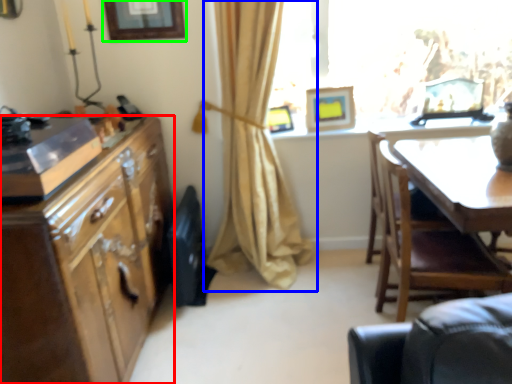
Question: Which object is the farthest from cabinetry (highlighted by a red box)? Choose among these: curtain (highlighted by a blue box) or picture frame (highlighted by a green box).

Choices:
 (A) curtain
 (B) picture frame

Answer: (B)